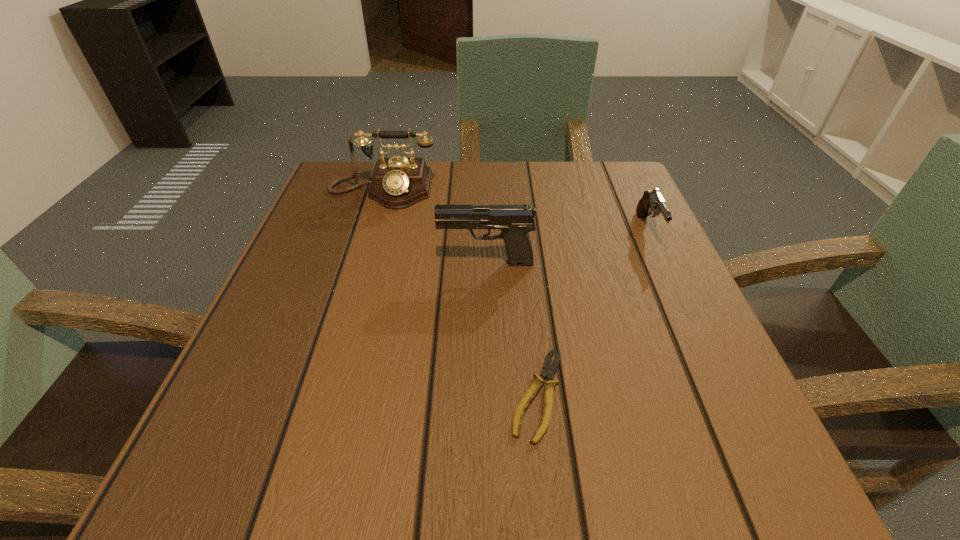
Where is `vacant space located 0.220m aim along the barrel of the nearer pistol`? Image resolution: width=960 pixels, height=540 pixels. vacant space located 0.220m aim along the barrel of the nearer pistol is located at coordinates (x=322, y=263).

This screenshot has width=960, height=540. In order to click on vacant space located aim along the barrel of the nearer pistol in this screenshot , I will do `click(380, 263)`.

The image size is (960, 540). I want to click on free space located at the barrel of the rightmost object, so click(717, 379).

Locate an element on the screen. Image resolution: width=960 pixels, height=540 pixels. vacant region located on the back of the shortest object is located at coordinates (521, 239).

Find the location of a particular element. Image resolution: width=960 pixels, height=540 pixels. telephone situated at the far edge is located at coordinates (398, 182).

You are a GUI agent. You are given a task and a screenshot of the screen. Output one action in this format:
    pyautogui.click(x=<x>, y=<y>)
    Task: Click on the pistol located in the far edge section of the desktop
    The width and height of the screenshot is (960, 540).
    Given the screenshot: What is the action you would take?
    pyautogui.click(x=652, y=201)

Where is `object that is positioned at the near edge`? This screenshot has height=540, width=960. object that is positioned at the near edge is located at coordinates (549, 370).

Identify the location of object positioned at the left edge. (398, 182).

What are the coordinates of `object positioned at the right edge` in the screenshot? It's located at (652, 201).

Locate an element on the screen. The height and width of the screenshot is (540, 960). object that is at the far left corner is located at coordinates (398, 182).